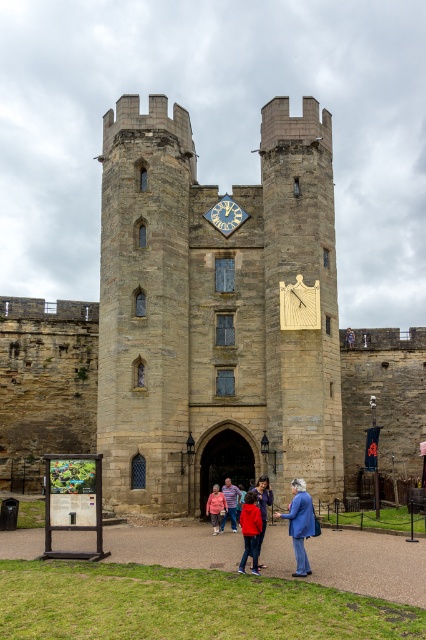
Between stone archway at center and goldmetallicclock at center, which one has more height?

Standing taller between the two is stone archway at center.

What do you see at coordinates (224, 464) in the screenshot? I see `stone archway at center` at bounding box center [224, 464].

The image size is (426, 640). Find the location of `stone archway at center`. stone archway at center is located at coordinates (224, 464).

Who is more distant from viewer, (249, 548) or (236, 228)?

Point (236, 228)

Does red fleece jacket at center have a greater width compared to goldmetallicclock at center?

In fact, red fleece jacket at center might be narrower than goldmetallicclock at center.

Describe the element at coordinates (250, 531) in the screenshot. The width and height of the screenshot is (426, 640). I see `red fleece jacket at center` at that location.

This screenshot has height=640, width=426. I want to click on red fleece jacket at center, so click(250, 531).

Between blue fabric coat at lower center and pink fabric jacket at center, which one has less height?

pink fabric jacket at center is shorter.

In the scene shown: Between blue fabric coat at lower center and pink fabric jacket at center, which one is positioned higher?

blue fabric coat at lower center

Which is behind, point (299, 573) or point (213, 502)?

Positioned behind is point (213, 502).

Identify the location of blue fabric coat at lower center. Image resolution: width=426 pixels, height=640 pixels. (299, 524).